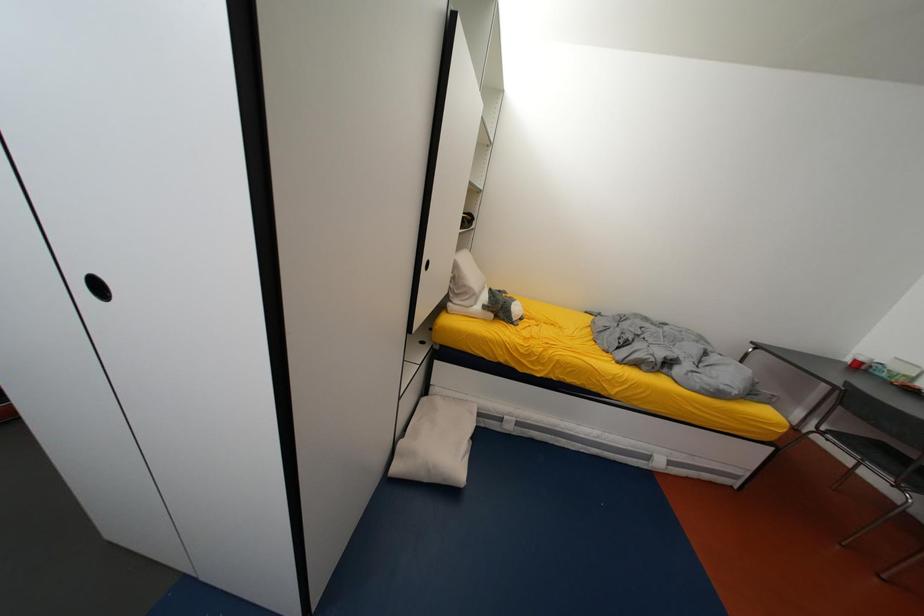
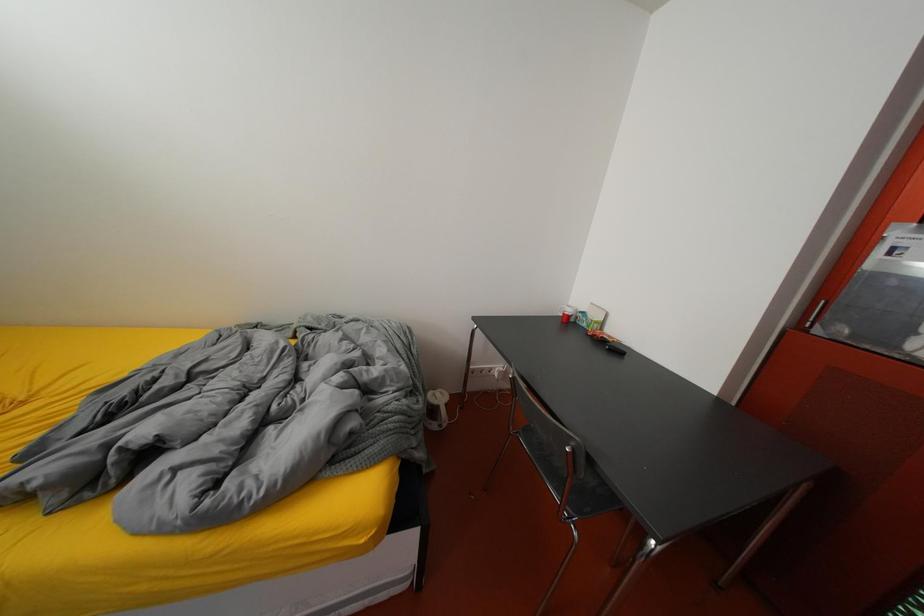
Which direction would the cameraman need to move to produce the second image?

The cameraman walked toward right, forward.